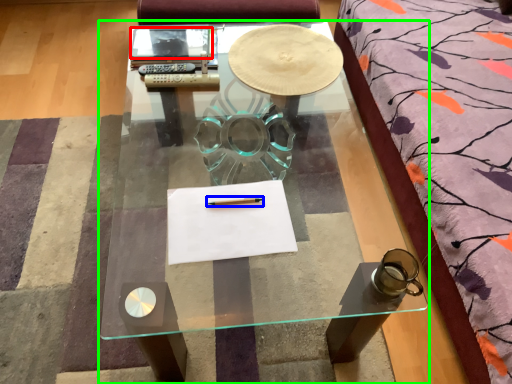
Question: Based on their relative distances, which object is nearer to notebook (highlighted by a red box)? Choose from pencil (highlighted by a blue box) and coffee table (highlighted by a green box).

Choices:
 (A) pencil
 (B) coffee table

Answer: (B)